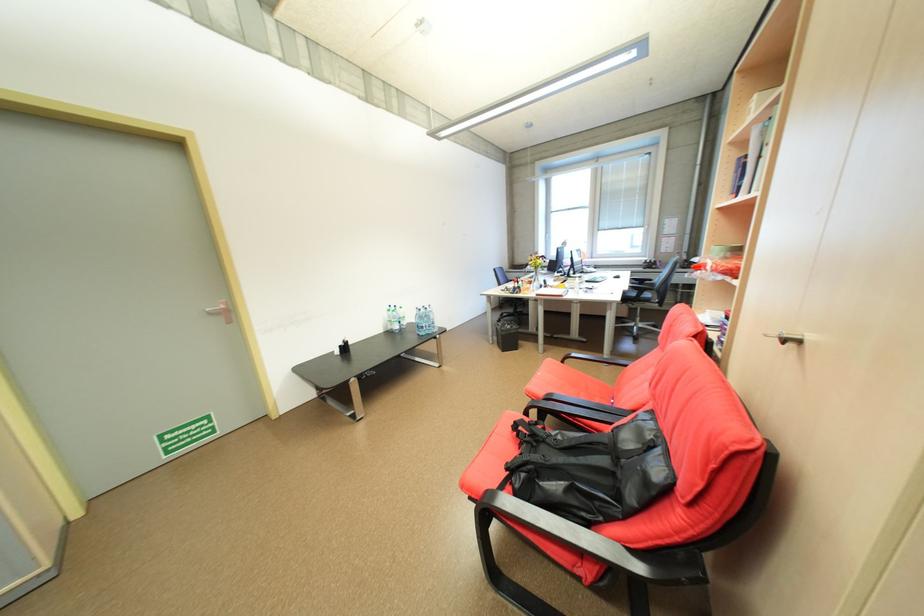
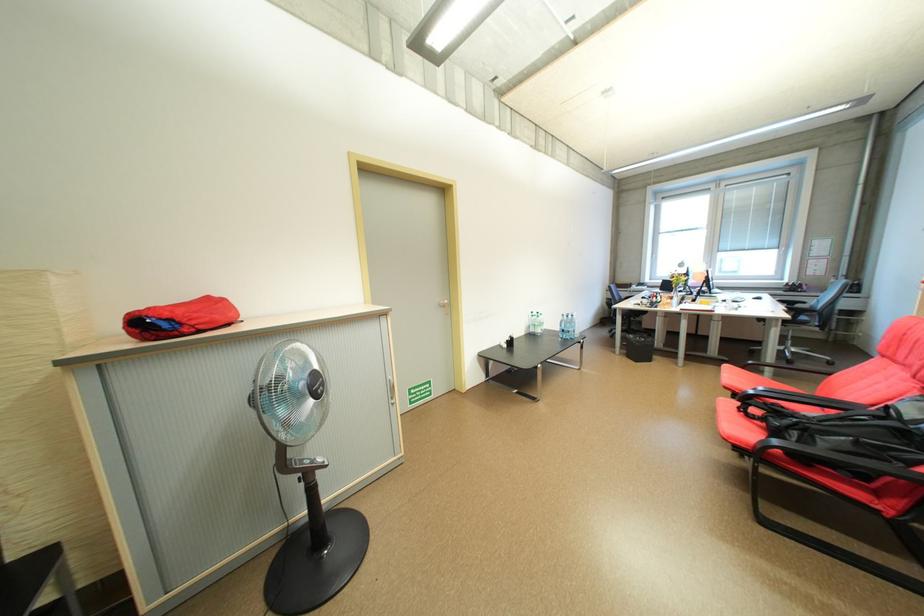
In the second image, find the point that corresponds to [398,328] in the first image.

(541, 331)